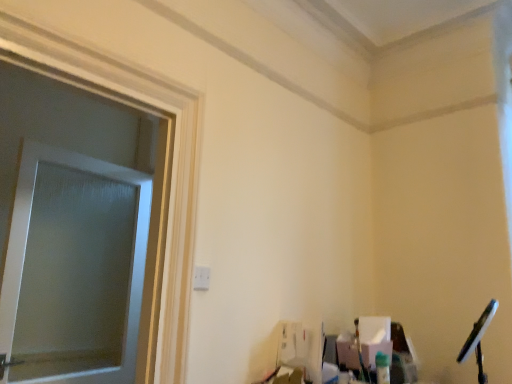
Question: From a real-world perspective, is frosted glass window screen at left positioned above or below white wood frame at left?

Choices:
 (A) below
 (B) above

Answer: (A)

Question: Looking at their shapes, would you say frosted glass window screen at left is wider or thinner than white wood frame at left?

Choices:
 (A) wide
 (B) thin

Answer: (B)

Question: Considering their positions, is frosted glass window screen at left located in front of or behind white wood frame at left?

Choices:
 (A) front
 (B) behind

Answer: (B)

Question: From the image's perspective, is white wood frame at left above or below frosted glass window screen at left?

Choices:
 (A) above
 (B) below

Answer: (A)

Question: In terms of size, does white wood frame at left appear bigger or smaller than frosted glass window screen at left?

Choices:
 (A) small
 (B) big

Answer: (B)

Question: Is white wood frame at left in front of or behind frosted glass window screen at left in the image?

Choices:
 (A) behind
 (B) front

Answer: (B)

Question: Considering the positions of white wood frame at left and frosted glass window screen at left in the image, is white wood frame at left taller or shorter than frosted glass window screen at left?

Choices:
 (A) tall
 (B) short

Answer: (A)